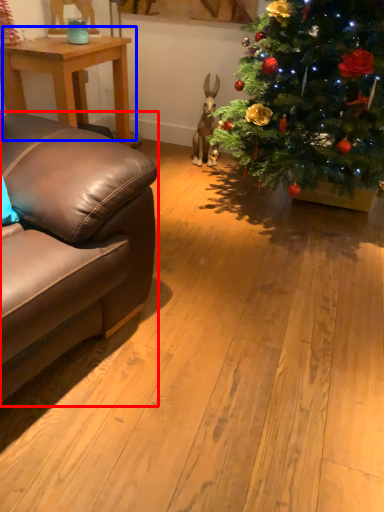
Question: Which point is closer to the camera, studio couch (highlighted by a red box) or table (highlighted by a blue box)?

Choices:
 (A) studio couch
 (B) table

Answer: (A)